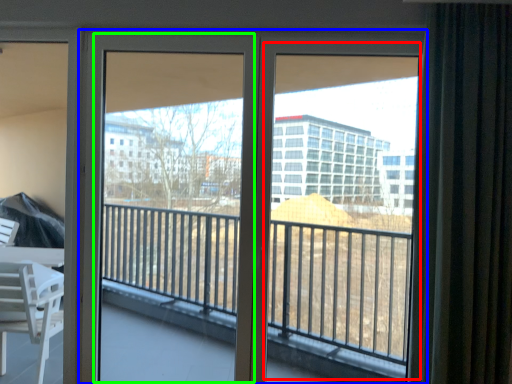
Question: Which object is positioned closest to window screen (highlighted by a red box)? Select from door (highlighted by a blue box) and screen door (highlighted by a green box).

Choices:
 (A) door
 (B) screen door

Answer: (A)